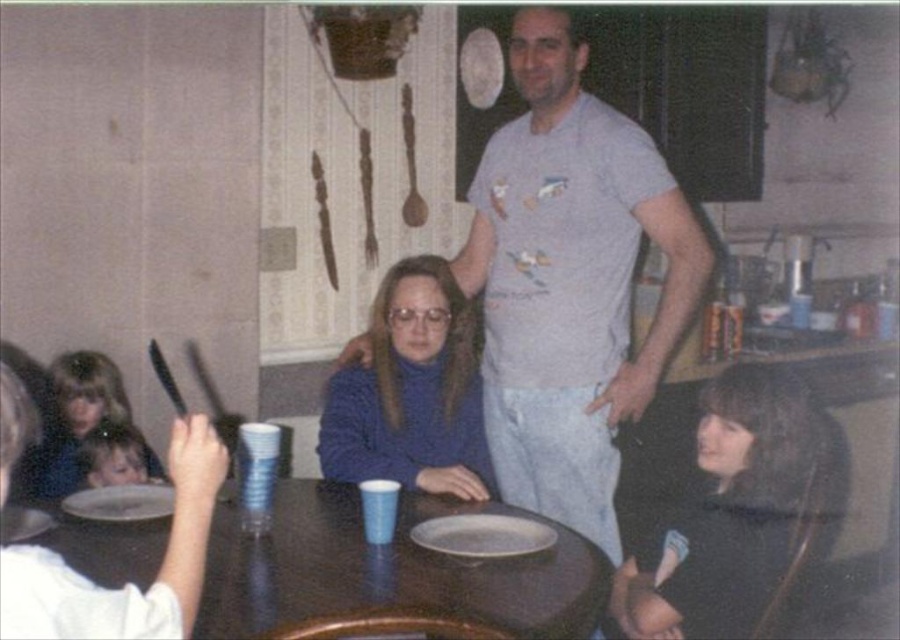
Question: Is blonde hair at left positioned in front of white matte plate at lower left?

Choices:
 (A) no
 (B) yes

Answer: (A)

Question: Which of the following is the farthest from the observer?

Choices:
 (A) (613, 280)
 (B) (32, 531)
 (C) (439, 310)
 (D) (667, 554)

Answer: (C)

Question: From the image, what is the correct spatial relationship of white matte plate at center in relation to white matte plate at lower left?

Choices:
 (A) right
 (B) left

Answer: (A)

Question: Among these points, which one is farthest from the camera?

Choices:
 (A) (419, 541)
 (B) (288, 556)

Answer: (A)

Question: Which point appears farthest from the camera in this image?

Choices:
 (A) (65, 394)
 (B) (793, 445)
 (C) (500, 516)
 (D) (81, 509)

Answer: (A)

Question: Does blonde hair at left appear over white matte plate at table center?

Choices:
 (A) no
 (B) yes

Answer: (B)